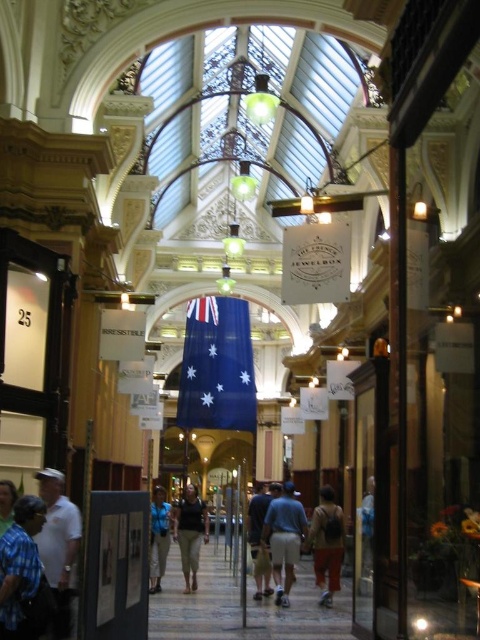
Question: Which point is farther to the camera?

Choices:
 (A) denim pants at center
 (B) light brown shorts at center

Answer: (B)

Question: Is blue fabric at center positioned in front of denim pants at center?

Choices:
 (A) no
 (B) yes

Answer: (A)

Question: Estimate the real-world distances between objects in this image. Which object is farther from the orange fabric pants at center?

Choices:
 (A) matte black shirt at center
 (B) blue fabric flag at center

Answer: (B)

Question: Is white shirt at lower left thinner than light brown shorts at center?

Choices:
 (A) no
 (B) yes

Answer: (B)

Question: Among these objects, which one is farthest from the camera?

Choices:
 (A) blue denim jeans at center
 (B) white shirt at lower left

Answer: (A)

Question: Can you confirm if blue denim jeans at center is positioned above blue fabric at center?

Choices:
 (A) no
 (B) yes

Answer: (A)